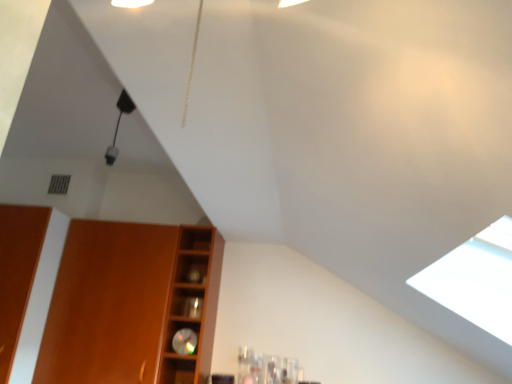
Question: Can you confirm if matte wood cabinet at left is shorter than wooden shelf at center?

Choices:
 (A) no
 (B) yes

Answer: (A)

Question: Is matte wood cabinet at left at the left side of wooden shelf at center?

Choices:
 (A) yes
 (B) no

Answer: (A)

Question: Is matte wood cabinet at left not near wooden shelf at center?

Choices:
 (A) no
 (B) yes

Answer: (A)

Question: From the image's perspective, is matte wood cabinet at left beneath wooden shelf at center?

Choices:
 (A) no
 (B) yes

Answer: (B)

Question: Is matte wood cabinet at left wider than wooden shelf at center?

Choices:
 (A) yes
 (B) no

Answer: (A)

Question: From the image's perspective, is matte wood cabinet at left located above wooden shelf at center?

Choices:
 (A) no
 (B) yes

Answer: (A)

Question: Considering the relative sizes of wooden shelf at center and matte wood cabinet at left in the image provided, is wooden shelf at center wider than matte wood cabinet at left?

Choices:
 (A) yes
 (B) no

Answer: (B)

Question: Is wooden shelf at center smaller than matte wood cabinet at left?

Choices:
 (A) no
 (B) yes

Answer: (B)

Question: From a real-world perspective, is wooden shelf at center positioned over matte wood cabinet at left based on gravity?

Choices:
 (A) yes
 (B) no

Answer: (A)

Question: Considering the relative sizes of wooden shelf at center and matte wood cabinet at left in the image provided, is wooden shelf at center bigger than matte wood cabinet at left?

Choices:
 (A) no
 (B) yes

Answer: (A)

Question: From a real-world perspective, is wooden shelf at center below matte wood cabinet at left?

Choices:
 (A) no
 (B) yes

Answer: (A)

Question: Is wooden shelf at center far from matte wood cabinet at left?

Choices:
 (A) no
 (B) yes

Answer: (A)

Question: From a real-world perspective, is matte wood cabinet at left physically located above or below wooden shelf at center?

Choices:
 (A) below
 (B) above

Answer: (A)